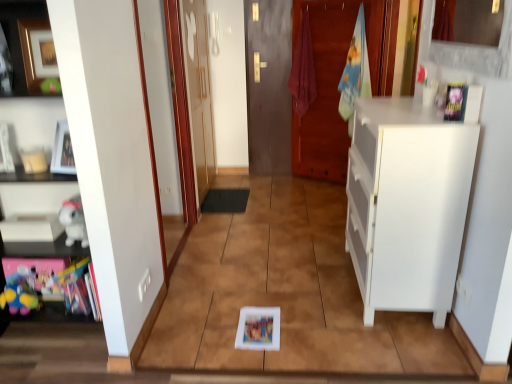
Question: From a real-world perspective, is multicolored plush toy at lower left, acting as the 2th toy starting from the top, positioned under black rubber mat at center based on gravity?

Choices:
 (A) yes
 (B) no

Answer: (B)

Question: Does multicolored plush toy at lower left, marked as the first toy in a left-to-right arrangement, lie behind black rubber mat at center?

Choices:
 (A) no
 (B) yes

Answer: (A)

Question: Is multicolored plush toy at lower left, marked as the first toy in a left-to-right arrangement, to the left of black rubber mat at center from the viewer's perspective?

Choices:
 (A) yes
 (B) no

Answer: (A)

Question: From the image's perspective, does multicolored plush toy at lower left, marked as the first toy in a left-to-right arrangement, appear lower than black rubber mat at center?

Choices:
 (A) no
 (B) yes

Answer: (B)

Question: Could black rubber mat at center be considered to be inside multicolored plush toy at lower left, arranged as the second toy when viewed from the right?

Choices:
 (A) yes
 (B) no

Answer: (B)

Question: Considering their positions, is brown wooden door at center, which appears as the second door when viewed from the left, located in front of or behind white matte cabinet at left, the 1th cabinetry positioned from the left?

Choices:
 (A) behind
 (B) front

Answer: (A)

Question: Is point (282, 48) closer or farther from the camera than point (52, 231)?

Choices:
 (A) closer
 (B) farther

Answer: (B)

Question: From a real-world perspective, relative to white matte cabinet at left, marked as the 2th cabinetry in a right-to-left arrangement, is brown wooden door at center, which appears as the second door when viewed from the left, vertically above or below?

Choices:
 (A) below
 (B) above

Answer: (B)

Question: From their relative heights in the image, would you say brown wooden door at center, which appears as the second door when viewed from the left, is taller or shorter than white matte cabinet at left, the 1th cabinetry positioned from the left?

Choices:
 (A) short
 (B) tall

Answer: (B)

Question: In the image, is matte red towel at center, the second laundry in the right-to-left sequence, positioned in front of or behind brown wooden door at center, which appears as the second door when viewed from the left?

Choices:
 (A) front
 (B) behind

Answer: (A)

Question: Looking at their shapes, would you say matte red towel at center, the second laundry in the right-to-left sequence, is wider or thinner than brown wooden door at center, which appears as the first door when viewed from the right?

Choices:
 (A) wide
 (B) thin

Answer: (A)

Question: From their relative heights in the image, would you say matte red towel at center, the second laundry in the right-to-left sequence, is taller or shorter than brown wooden door at center, which appears as the first door when viewed from the right?

Choices:
 (A) tall
 (B) short

Answer: (B)

Question: From the image's perspective, is matte red towel at center, the second laundry in the right-to-left sequence, positioned above or below brown wooden door at center, which appears as the second door when viewed from the left?

Choices:
 (A) below
 (B) above

Answer: (B)

Question: Is matte red towel at center, acting as the first laundry starting from the left, bigger or smaller than transparent glass door at upper left, the first door positioned from the left?

Choices:
 (A) small
 (B) big

Answer: (A)

Question: Is point (308, 66) positioned closer to the camera than point (190, 48)?

Choices:
 (A) closer
 (B) farther

Answer: (B)